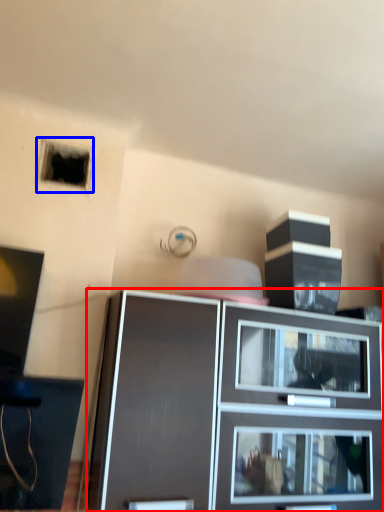
Question: Which object is further to the camera taking this photo, cabinetry (highlighted by a red box) or hole (highlighted by a blue box)?

Choices:
 (A) cabinetry
 (B) hole

Answer: (B)